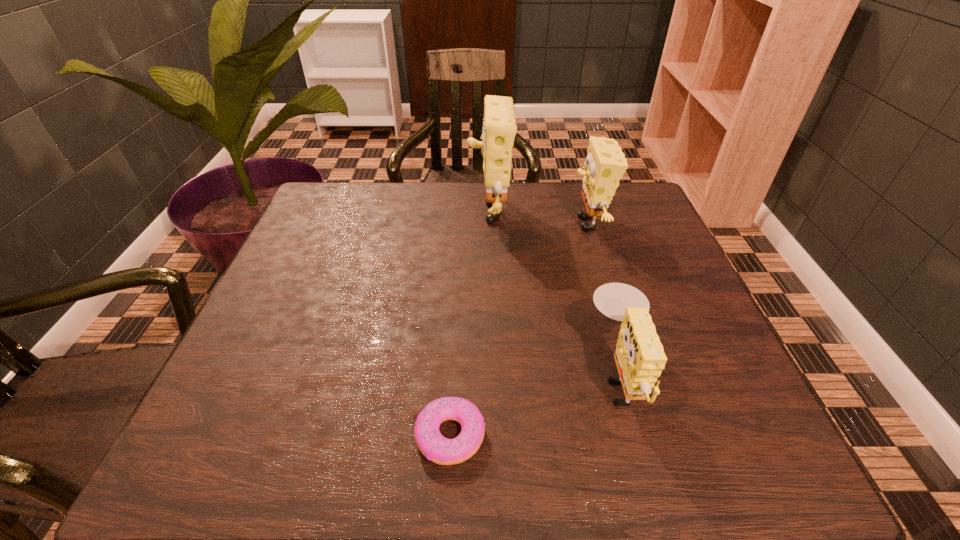
Where is `the tallest object`? the tallest object is located at coordinates (499, 129).

Where is `the tallest sponge`? the tallest sponge is located at coordinates (499, 129).

This screenshot has width=960, height=540. In order to click on the second tallest sponge in this screenshot , I will do `click(605, 164)`.

Locate an element on the screen. Image resolution: width=960 pixels, height=540 pixels. the second shortest object is located at coordinates (639, 356).

This screenshot has height=540, width=960. I want to click on the nearest sponge, so click(x=639, y=356).

Where is `the shortest object`? the shortest object is located at coordinates (432, 444).

At what (x,y) coordinates should I click in order to perform the action: click on vacant point located 0.230m on the face of the tallest object. Please return your answer as a coordinate pair (x, y). This screenshot has width=960, height=540. Looking at the image, I should click on (384, 208).

This screenshot has width=960, height=540. What are the coordinates of `free point located on the face of the tallest object` in the screenshot? It's located at (376, 208).

I want to click on vacant region located on the face of the tallest object, so click(402, 208).

Find the location of a particular element. Image resolution: width=960 pixels, height=540 pixels. vacant region located on the face of the second shortest sponge is located at coordinates click(420, 223).